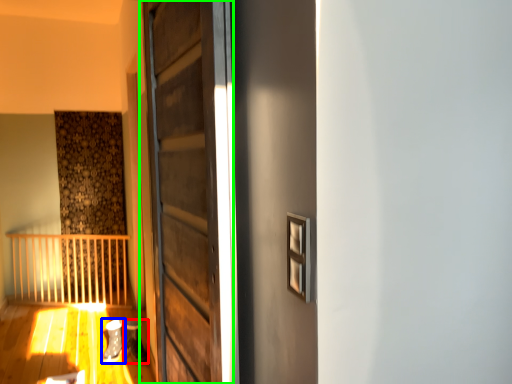
Question: Which object is positioned farthest from shoe (highlighted by a red box)? Select from shoe (highlighted by a blue box) and door (highlighted by a green box).

Choices:
 (A) shoe
 (B) door

Answer: (B)